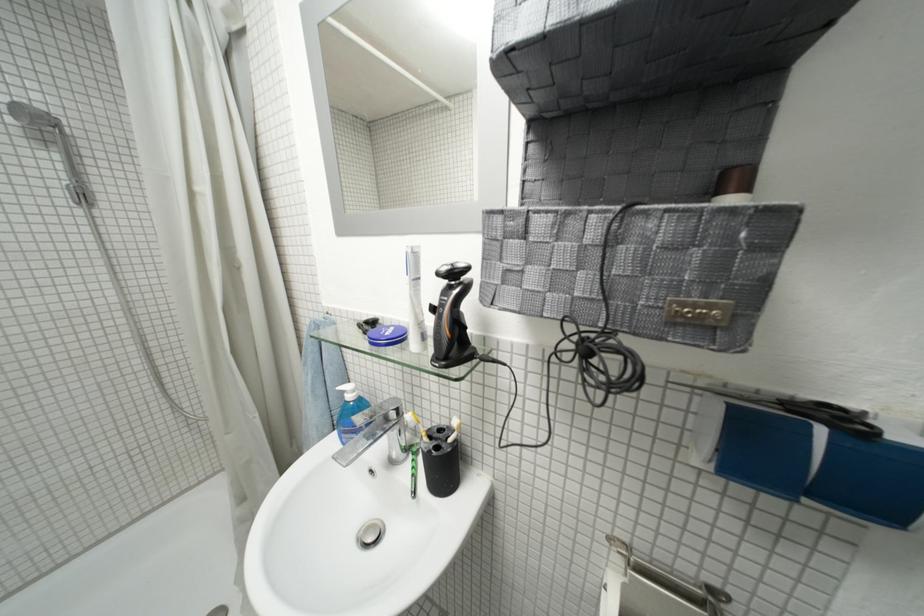
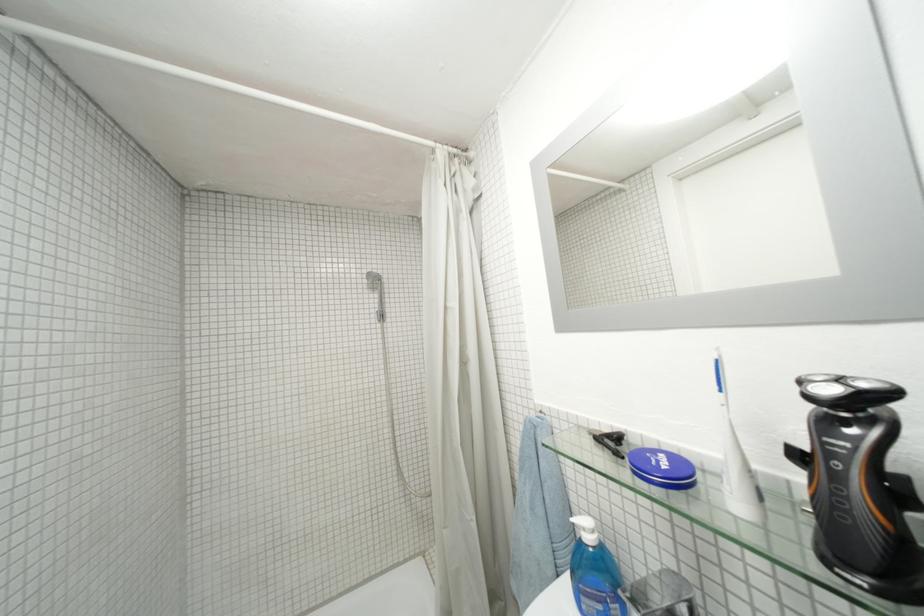
Find the pixel in the second image that matches (x=45, y=185) in the first image.

(375, 314)